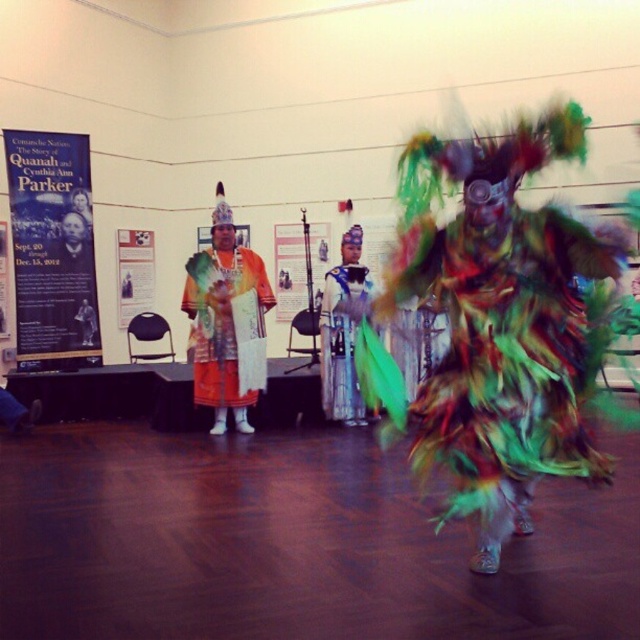
Question: Does multicolored feathered costume at center have a greater width compared to shiny metallic headdress at center?

Choices:
 (A) yes
 (B) no

Answer: (A)

Question: Which of these objects is positioned farthest from the white paper poster at center?

Choices:
 (A) matte orange fabric at center
 (B) multicolored feathered costume at center
 (C) blue paper poster at left

Answer: (B)

Question: Is multicolored feathered costume at center bigger than matte orange fabric at center?

Choices:
 (A) yes
 (B) no

Answer: (A)

Question: Can you confirm if matte orange fabric at center is bigger than white paper poster at center?

Choices:
 (A) no
 (B) yes

Answer: (B)

Question: Which point appears closest to the camera in this image?

Choices:
 (A) (81, 355)
 (B) (150, 305)
 (C) (371, 292)

Answer: (C)

Question: Among these objects, which one is nearest to the camera?

Choices:
 (A) matte orange fabric at center
 (B) white paper poster at center
 (C) shiny metallic headdress at center

Answer: (A)